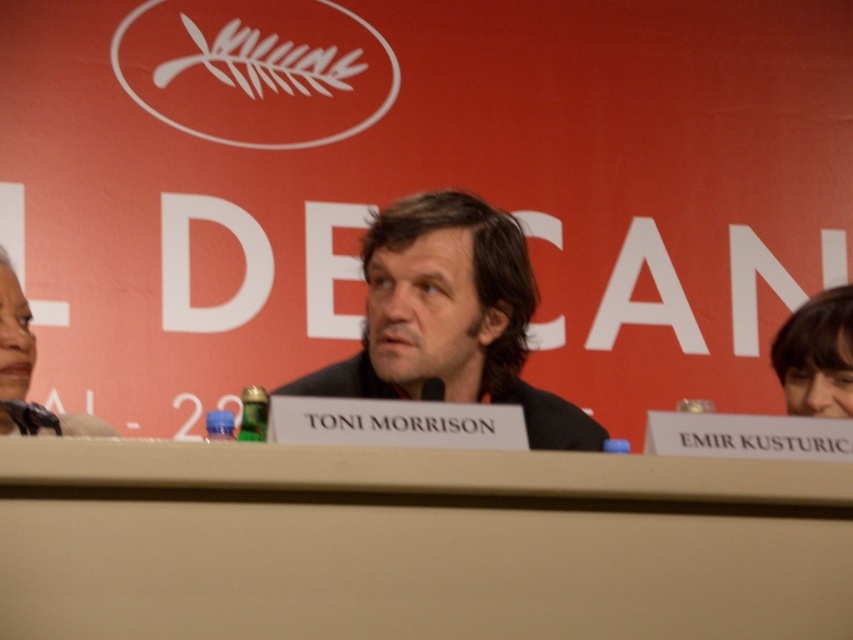
Question: Is dark brown hair at center above matte black hair at left?

Choices:
 (A) no
 (B) yes

Answer: (A)

Question: Is beige plastic table at center smaller than smooth brown hair at upper right?

Choices:
 (A) no
 (B) yes

Answer: (A)

Question: Which point is closer to the camera?

Choices:
 (A) (784, 362)
 (B) (57, 422)
 (C) (438, 256)
 (D) (550, 468)

Answer: (D)

Question: Which object is the closest to the matte black hair at left?

Choices:
 (A) dark brown hair at center
 (B) beige plastic table at center

Answer: (A)

Question: Among these points, which one is farthest from the camera?

Choices:
 (A) (447, 282)
 (B) (416, 572)

Answer: (A)

Question: Can you confirm if dark brown hair at center is thinner than smooth brown hair at upper right?

Choices:
 (A) yes
 (B) no

Answer: (B)